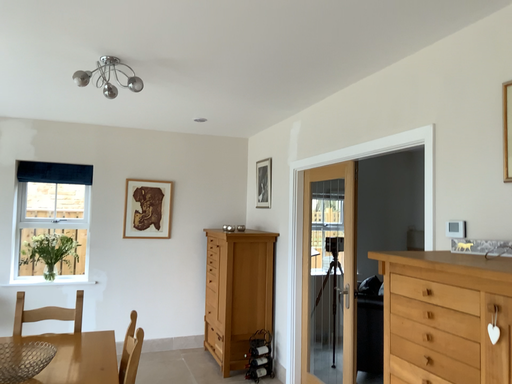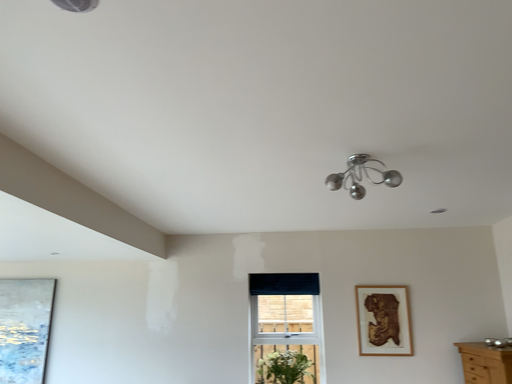
Question: Which way did the camera rotate in the video?

Choices:
 (A) rotated downward
 (B) rotated upward

Answer: (B)